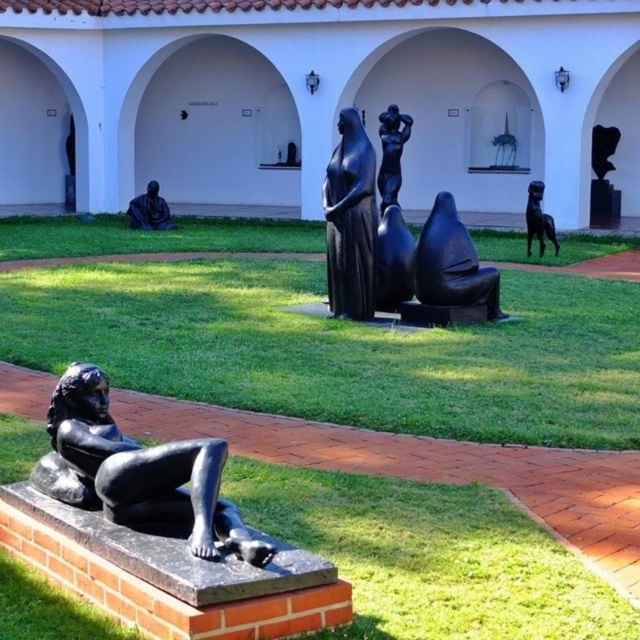
Describe the element at coordinates (349, 220) in the screenshot. The height and width of the screenshot is (640, 640). I see `black polished statue at center` at that location.

Is black polished statue at center positioned at the back of black matte statue at upper right?

No, black polished statue at center is closer to the viewer.

Between point (337, 184) and point (604, 164), which one is positioned behind?

The point (604, 164) is more distant.

Locate an element on the screen. The image size is (640, 640). black polished statue at center is located at coordinates (349, 220).

Is green grass at center shorter than black polished stone figure at center?

Incorrect, green grass at center's height does not fall short of black polished stone figure at center's.

Where is `green grass at center`? This screenshot has width=640, height=640. green grass at center is located at coordinates (340, 349).

Locate an element on the screen. The image size is (640, 640). green grass at center is located at coordinates (340, 349).

Is polished bronze statue at center shorter than polished bronze horse at center?

No, polished bronze statue at center is not shorter than polished bronze horse at center.

Looking at this image, can you confirm if polished bronze statue at center is taller than polished bronze horse at center?

Correct, polished bronze statue at center is much taller as polished bronze horse at center.

Is point (385, 182) in front of point (531, 228)?

No, it is behind (531, 228).

You are a GUI agent. You are given a task and a screenshot of the screen. Output one action in this format:
    pyautogui.click(x=<x>, y=<y>)
    Task: Click on the polished bronze statue at center
    The height and width of the screenshot is (640, 640).
    Given the screenshot: What is the action you would take?
    pyautogui.click(x=392, y=154)